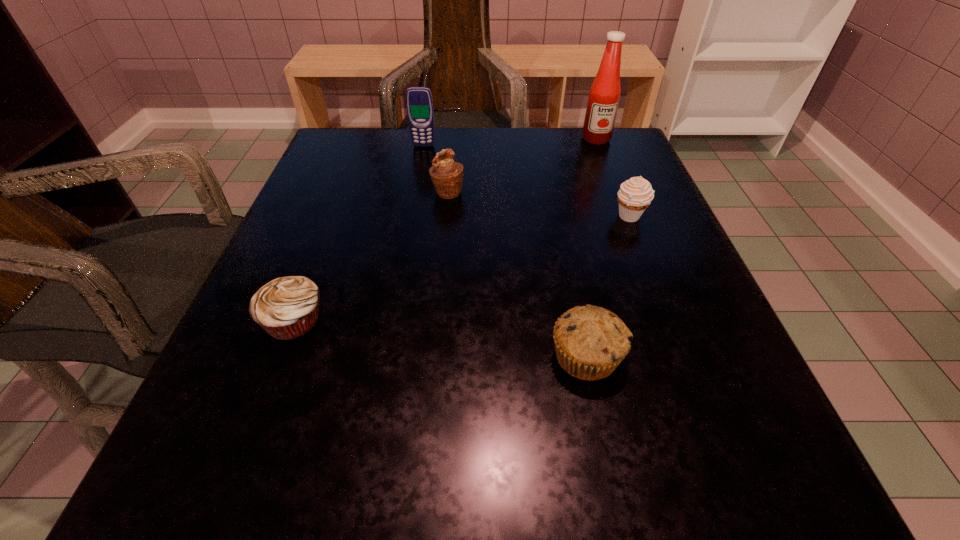
This screenshot has width=960, height=540. I want to click on condiment, so click(x=604, y=95).

The image size is (960, 540). What are the coordinates of `the fifth shortest object` in the screenshot? It's located at (419, 103).

The height and width of the screenshot is (540, 960). What are the coordinates of `the fifth object from right to left` in the screenshot? It's located at (419, 103).

Where is `the fourth object from right to left`? the fourth object from right to left is located at coordinates (447, 176).

I want to click on the farthest muffin, so click(x=447, y=176).

Identify the location of the rightmost muffin. pyautogui.click(x=635, y=195).

Locate an element on the screen. the second farthest muffin is located at coordinates (635, 195).

The height and width of the screenshot is (540, 960). In order to click on the third object from right to left in this screenshot , I will do `click(590, 342)`.

Where is `the leftmost object`? The height and width of the screenshot is (540, 960). the leftmost object is located at coordinates (286, 308).

You are a GUI agent. You are given a task and a screenshot of the screen. Output one action in this format:
    pyautogui.click(x=<x>, y=<y>)
    Task: Click on the free space located 0.160m on the front-facing side of the condiment
    This screenshot has width=960, height=540.
    Given the screenshot: What is the action you would take?
    [613, 184]